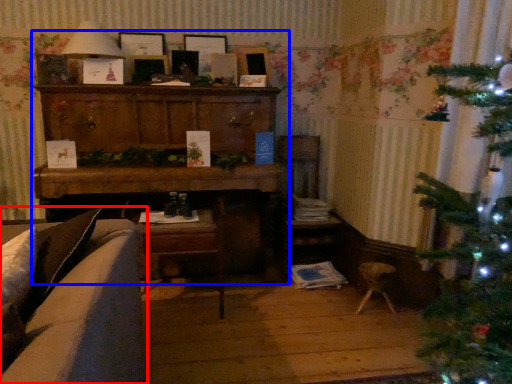
Question: Which object appears closest to the camera in this image, studio couch (highlighted by a red box) or entertainment center (highlighted by a blue box)?

Choices:
 (A) studio couch
 (B) entertainment center

Answer: (A)